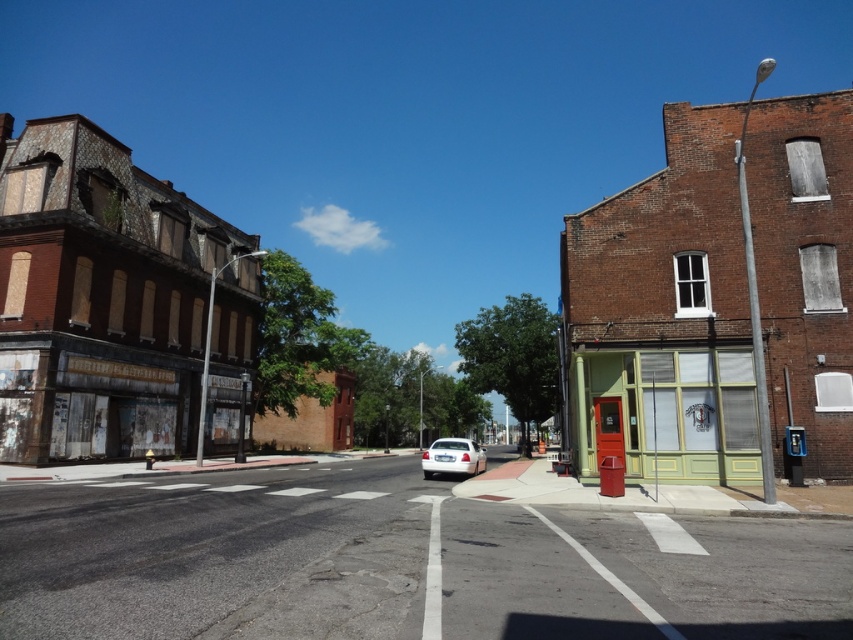
Can you confirm if smooth asphalt road at center is positioned above white glossy sedan at center?

Yes.

Between point (195, 502) and point (474, 474), which one is positioned behind?

Point (474, 474)

Is point (799, 637) behind point (426, 460)?

No, it is not.

The width and height of the screenshot is (853, 640). Find the location of `smooth asphalt road at center`. smooth asphalt road at center is located at coordinates (397, 563).